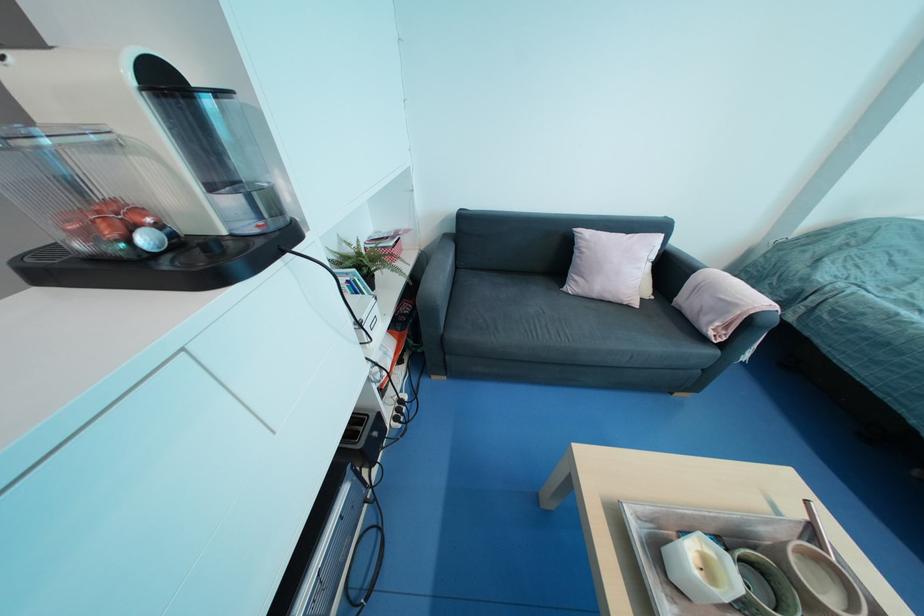
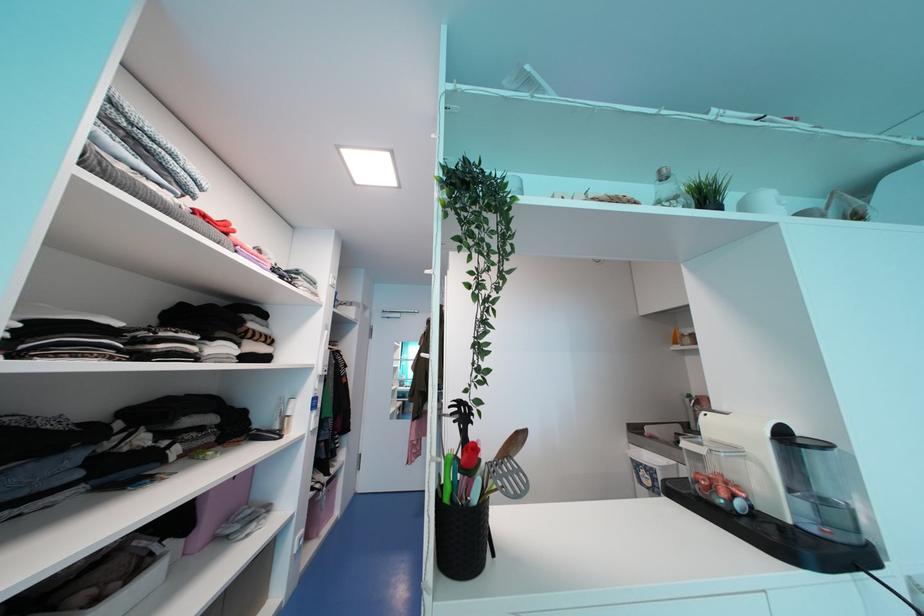
How did the camera likely rotate?

The rotation direction of the camera is left-up.